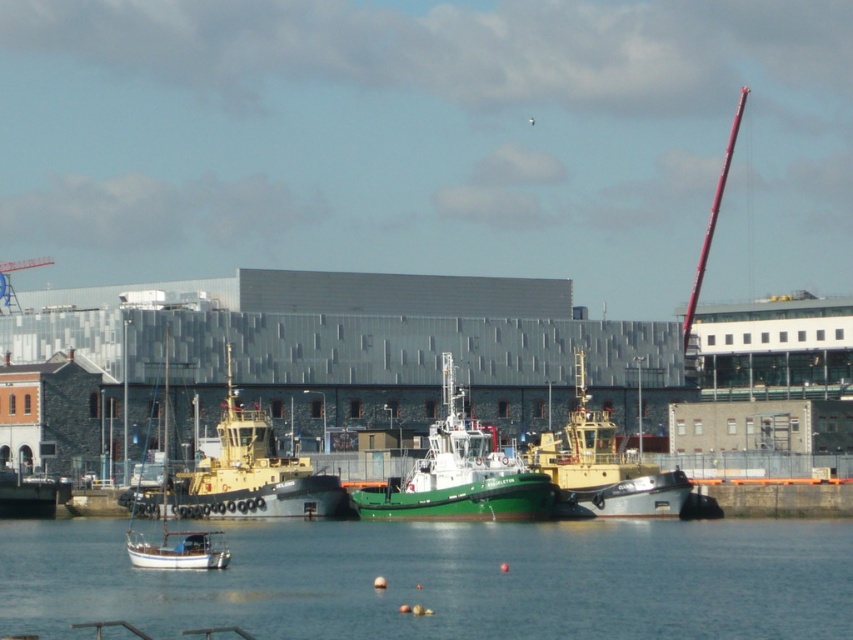
Between transparent water at lower center and white matte sailboat at center, which one is positioned higher?

white matte sailboat at center is higher up.

Describe the element at coordinates (447, 580) in the screenshot. I see `transparent water at lower center` at that location.

Describe the element at coordinates (447, 580) in the screenshot. I see `transparent water at lower center` at that location.

This screenshot has width=853, height=640. What are the coordinates of `transparent water at lower center` in the screenshot? It's located at (447, 580).

Who is taller, yellow matte tugboat at center or smooth red pole at upper right?

smooth red pole at upper right is taller.

Find the location of `yellow matte tugboat at center`. yellow matte tugboat at center is located at coordinates (602, 467).

Is point (514, 504) farther from viewer compared to point (173, 557)?

Yes, it is.

Does green matte tugboat at center appear on the left side of white matte sailboat at center?

No, green matte tugboat at center is not to the left of white matte sailboat at center.

Is point (521, 476) positioned before point (144, 566)?

No, (521, 476) is behind (144, 566).

This screenshot has width=853, height=640. I want to click on green matte tugboat at center, so [x=459, y=474].